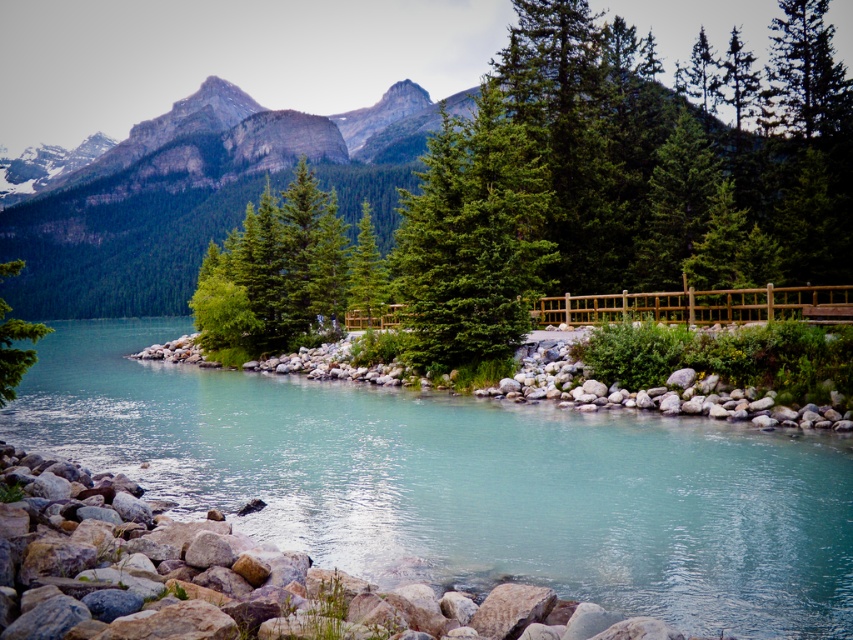
You are standing at the wooden railing and want to take a photo of both the clear water at center and the green matte tree at left. Which object will appear larger in your photo?

The clear water at center will appear larger in the photo because it is closer to the viewer than the green matte tree at left.

You are standing at the point with coordinates 0.5, 0.5 in this landscape. You want to walk to the clear water at center. Which direction should you move in to reach it?

The clear water at center is located at point (466, 483), so you should move towards the northeast direction from your current position at (426, 320) to reach it.